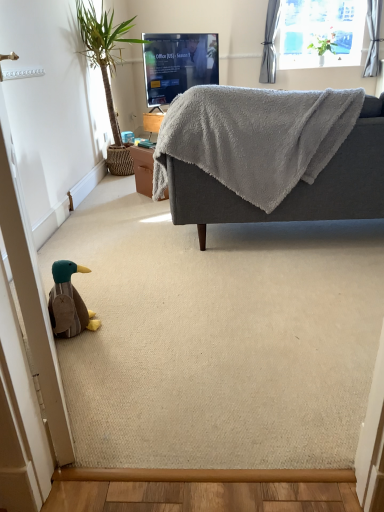
Identify the location of vacant area that lies in front of gray soft fabric couch at upper right. The image size is (384, 512). (259, 318).